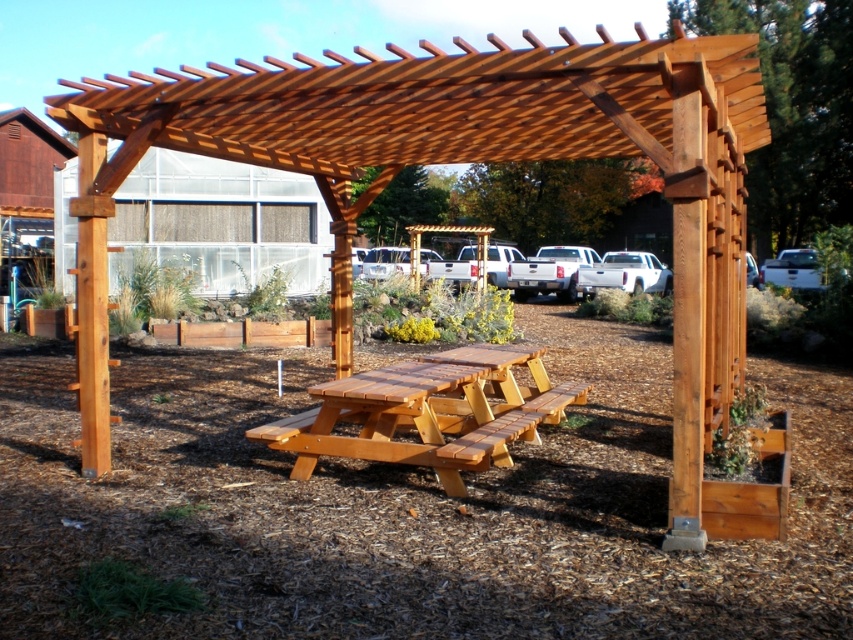
Question: Which point appears closest to the camera in this image?

Choices:
 (A) [465, 436]
 (B) [630, 92]

Answer: (B)

Question: Which point is closer to the camera taking this photo?

Choices:
 (A) (506, 461)
 (B) (432, 113)

Answer: (B)

Question: Is natural wood pergola at center wider than natural wood picnic table at center?

Choices:
 (A) yes
 (B) no

Answer: (A)

Question: Can you confirm if natural wood pergola at center is smaller than natural wood picnic table at center?

Choices:
 (A) yes
 (B) no

Answer: (B)

Question: Where is natural wood pergola at center located in relation to natural wood picnic table at center in the image?

Choices:
 (A) above
 (B) below

Answer: (A)